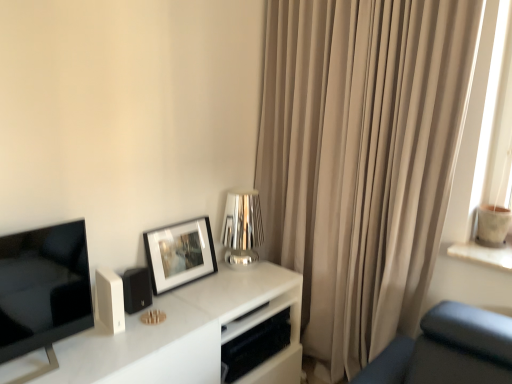
The height and width of the screenshot is (384, 512). What are the coordinates of `vacant space in front of white plastic speaker at lower left` in the screenshot? It's located at (94, 356).